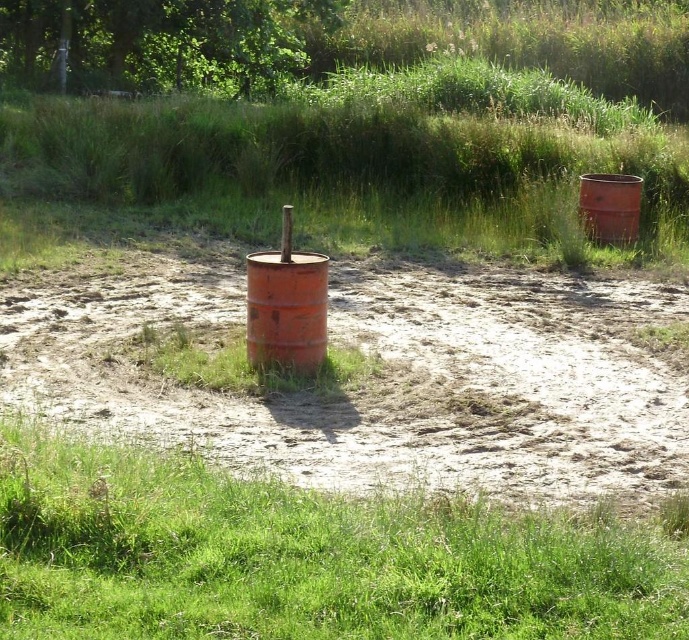
You are a gardener trying to place a new plant between the dull orange barrel at center and the rusty metal barrel at right. Which barrel should you stand next to to ensure the plant is placed between them?

You should stand next to the dull orange barrel at center because it is to the left of the rusty metal barrel at right, so placing the plant between them would require positioning it to the right of the dull orange barrel at center and to the left of the rusty metal barrel at right.

You are a delivery person carrying a heavy box and need to move from the rusty metal barrel at center to the rusty metal barrel at right. The path between them is clear but uneven. Can you walk straight between them without needing to detour around the barrels?

The distance between the rusty metal barrel at center and the rusty metal barrel at right is 7.06 meters, so yes, you can walk straight between them without needing to detour around the barrels since the path is clear and the distance allows for a direct path.

You are standing at the origin point of the image. Which object is located at the coordinates point (380, 378)?

The dull orange barrel at center is located at point (380, 378).